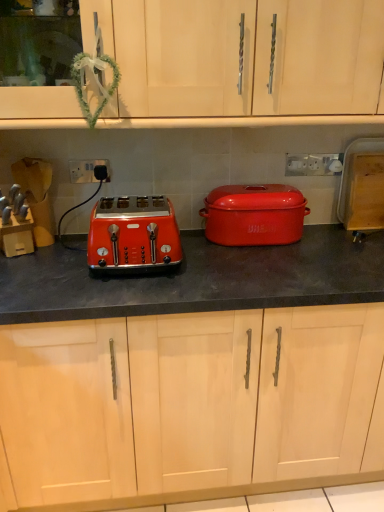
Find the location of a particular element. free location to the left of matte orange toaster at left is located at coordinates [55, 268].